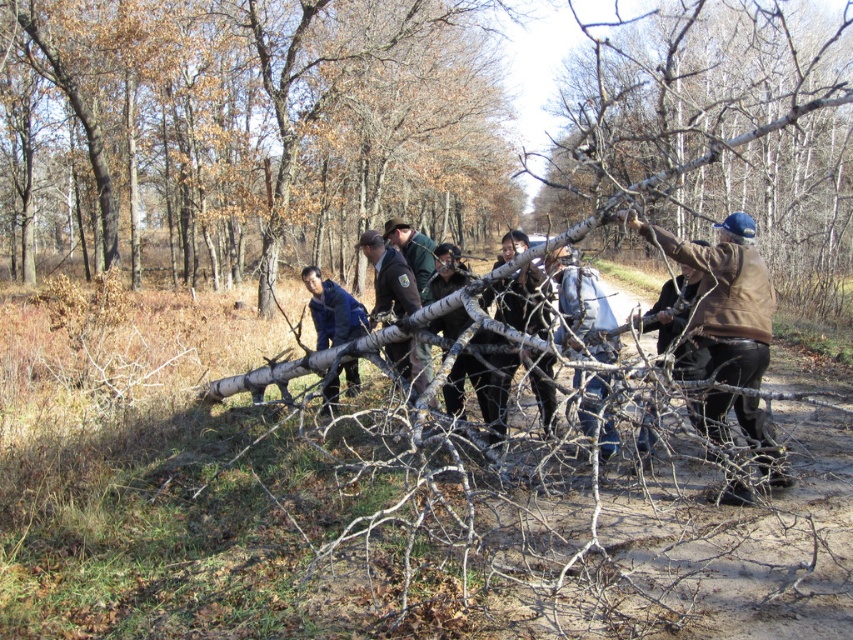
Question: Among these points, which one is nearest to the camera?

Choices:
 (A) (401, 296)
 (B) (341, 324)
 (C) (602, 356)
 (D) (762, 284)

Answer: (D)

Question: Which object is the closest to the brown bark tree at center?

Choices:
 (A) brown uniform at center
 (B) denim jeans at center
 (C) brown leather jacket at right
 (D) blue fabric jacket at center

Answer: (D)

Question: Is brown bark tree at center closer to the viewer compared to denim jeans at center?

Choices:
 (A) no
 (B) yes

Answer: (A)

Question: Can you confirm if brown bark tree at center is bigger than brown leather jacket at right?

Choices:
 (A) yes
 (B) no

Answer: (A)

Question: In this image, where is brown bark tree at center located relative to blue fabric jacket at center?

Choices:
 (A) right
 (B) left

Answer: (B)

Question: Which of the following is the farthest from the observer?

Choices:
 (A) (201, 205)
 (B) (329, 314)
 (C) (607, 440)

Answer: (A)